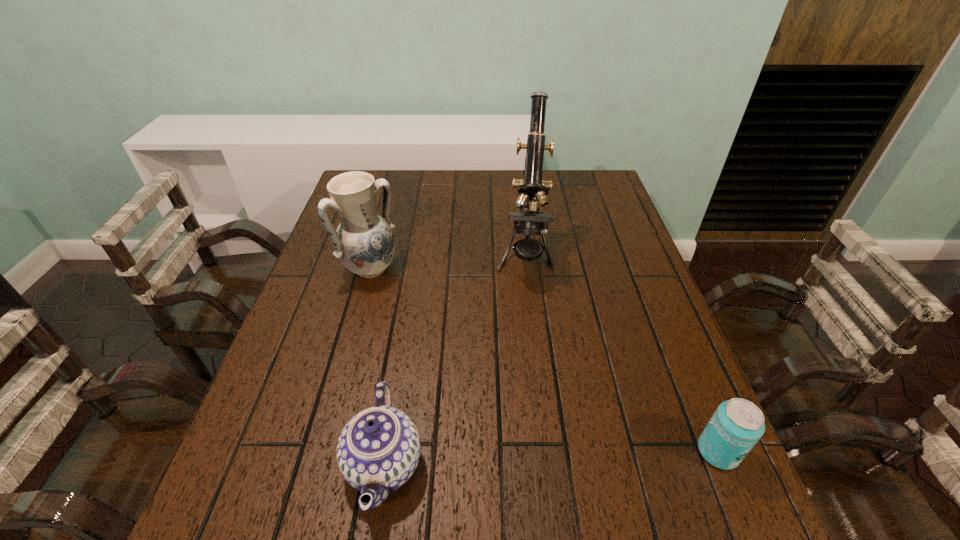
In the image, there is a desktop. At what (x,y) coordinates should I click in order to perform the action: click on vacant space at the far edge. Please return your answer as a coordinate pair (x, y). Image resolution: width=960 pixels, height=540 pixels. Looking at the image, I should click on pyautogui.click(x=466, y=187).

In the image, there is a desktop. What are the coordinates of `vacant space at the near edge` in the screenshot? It's located at 446,467.

The height and width of the screenshot is (540, 960). In the image, there is a desktop. Find the location of `free space at the left edge`. free space at the left edge is located at coordinates (289, 408).

The height and width of the screenshot is (540, 960). What are the coordinates of `free region at the right edge of the desktop` in the screenshot? It's located at (598, 236).

You are a GUI agent. You are given a task and a screenshot of the screen. Output one action in this format:
    pyautogui.click(x=<x>, y=<y>)
    Task: Click on the vacant space at the near left corner of the desktop
    The image size is (960, 540).
    Given the screenshot: What is the action you would take?
    pyautogui.click(x=247, y=437)

Find the location of a particular element. The width and height of the screenshot is (960, 540). vacant point at the far right corner is located at coordinates point(589,206).

I want to click on free space at the near right corner, so click(x=665, y=454).

This screenshot has width=960, height=540. What are the coordinates of `empty space that is in between the second object from right to left and the chinaware` in the screenshot? It's located at (454, 359).

The image size is (960, 540). What are the coordinates of `free space between the microscope and the rightmost object` in the screenshot? It's located at (621, 353).

I want to click on free spot between the rightmost object and the tallest object, so click(x=621, y=353).